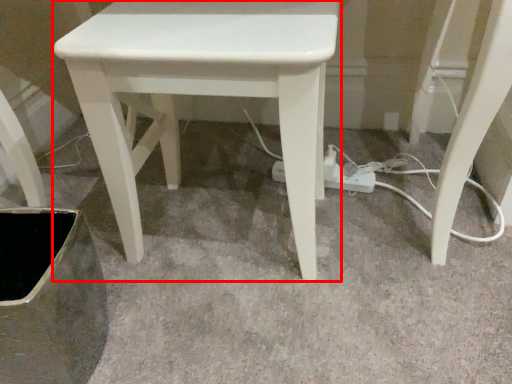
Question: From the image's perspective, where is stool (annotated by the red box) located in relation to extension cord in the image?

Choices:
 (A) above
 (B) below

Answer: (A)